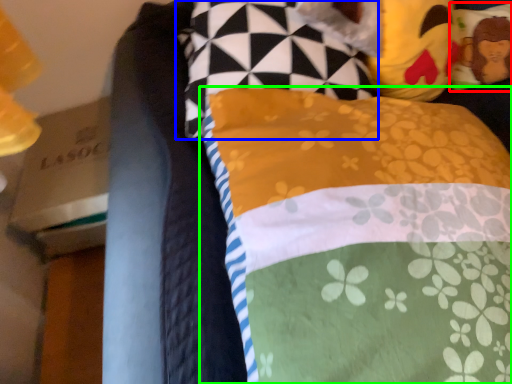
Question: Considering the real-world distances, which object is farthest from pillow (highlighted by a red box)? pillow (highlighted by a blue box) or pillow (highlighted by a green box)?

Choices:
 (A) pillow
 (B) pillow

Answer: (B)